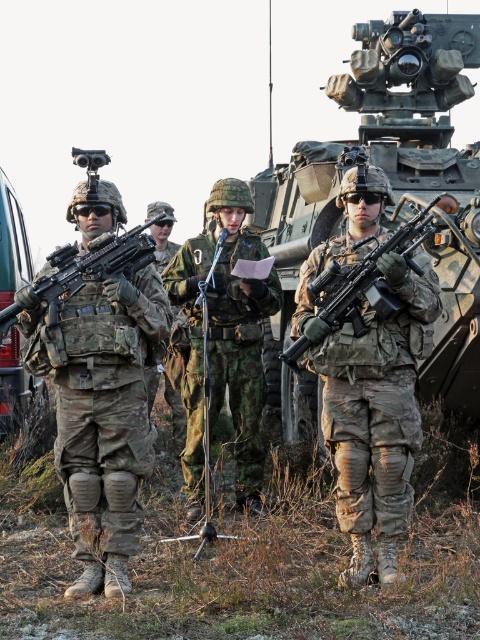
Question: Is camouflage textured tank at center wider than camouflage fabric rifle at left?

Choices:
 (A) yes
 (B) no

Answer: (A)

Question: Estimate the real-world distances between objects in this image. Which object is farther from the matte black rifle at left?

Choices:
 (A) camouflage fabric rifle at left
 (B) metallic green vehicle at left

Answer: (B)

Question: Which point appears closest to the camera in this image?

Choices:
 (A) (142, 230)
 (B) (22, 212)

Answer: (A)

Question: Is the position of camouflage fabric rifle at center less distant than that of matte black rifle at center?

Choices:
 (A) yes
 (B) no

Answer: (A)

Question: Does camo fabric uniform at center come behind matte black rifle at center?

Choices:
 (A) no
 (B) yes

Answer: (B)

Question: Which point is farther from the camera taking this photo?

Choices:
 (A) (14, 339)
 (B) (0, 336)

Answer: (A)